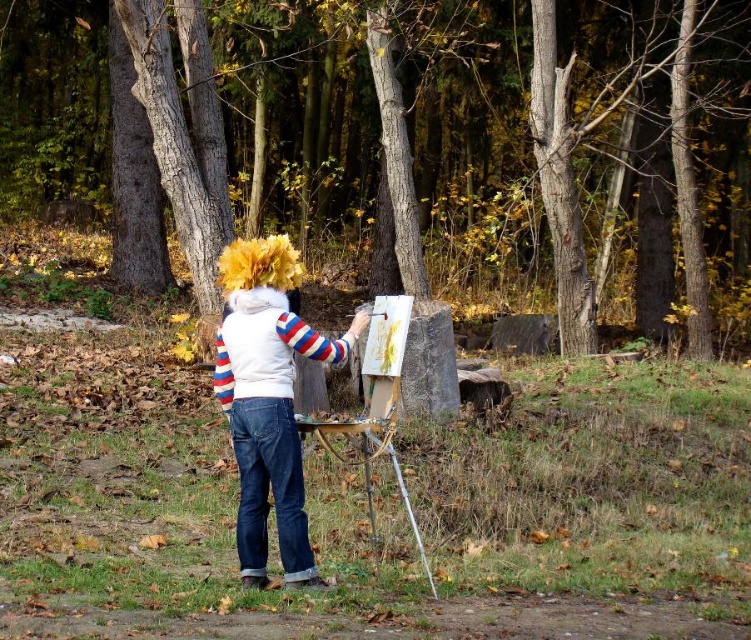
Question: Which of the following is the closest to the observer?

Choices:
 (A) (62, 134)
 (B) (222, 378)

Answer: (B)

Question: Which of the following is the farthest from the observer?

Choices:
 (A) (261, 305)
 (B) (712, 212)

Answer: (B)

Question: Can you confirm if brown textured trunk at center is bigger than denim jacket at center?

Choices:
 (A) yes
 (B) no

Answer: (A)

Question: Which object is the farthest from the brown textured trunk at center?

Choices:
 (A) metallic silver easel at center
 (B) denim jacket at center

Answer: (B)

Question: Is brown textured trunk at center positioned in front of denim jacket at center?

Choices:
 (A) no
 (B) yes

Answer: (A)

Question: In this image, where is brown textured trunk at center located relative to metallic silver easel at center?

Choices:
 (A) above
 (B) below

Answer: (A)